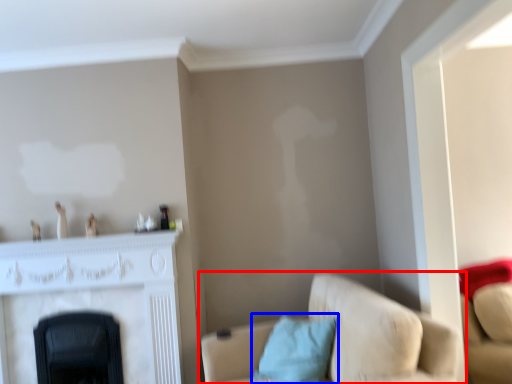
Question: Which point is closer to the camera, studio couch (highlighted by a red box) or pillow (highlighted by a blue box)?

Choices:
 (A) studio couch
 (B) pillow

Answer: (A)